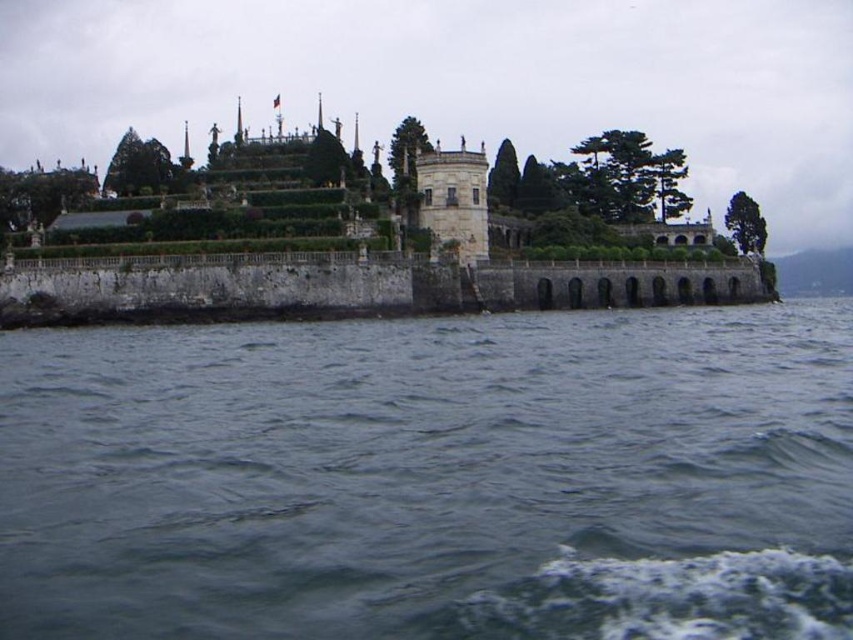
Which is behind, point (730, 228) or point (405, 136)?

The point (730, 228) is behind.

Locate an element on the screen. Image resolution: width=853 pixels, height=640 pixels. green textured tree at upper right is located at coordinates [x=746, y=224].

This screenshot has height=640, width=853. What are the coordinates of `green textured tree at upper right` in the screenshot? It's located at tap(746, 224).

Does green leafy tree at upper left have a greater width compared to green leafy tree at center?

Correct, the width of green leafy tree at upper left exceeds that of green leafy tree at center.

Who is more forward, (x=9, y=212) or (x=421, y=138)?

Point (x=9, y=212)

Locate an element on the screen. The image size is (853, 640). green leafy tree at upper left is located at coordinates (41, 193).

Does gray water at lower left appear over green textured trees at upper center?

Actually, gray water at lower left is below green textured trees at upper center.

Where is `gray water at lower left`? The height and width of the screenshot is (640, 853). gray water at lower left is located at coordinates (432, 477).

You are a GUI agent. You are given a task and a screenshot of the screen. Output one action in this format:
    pyautogui.click(x=<x>, y=<y>)
    Task: Click on the gray water at lower left
    
    Given the screenshot: What is the action you would take?
    pyautogui.click(x=432, y=477)